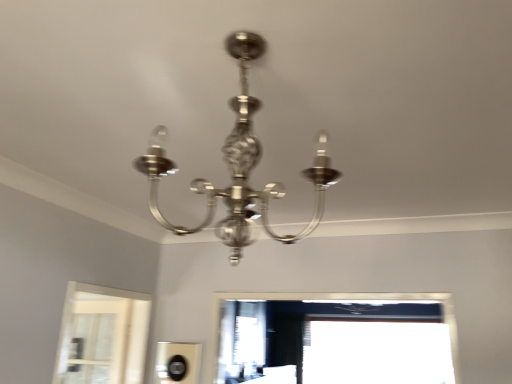
Question: Is polished silver chandelier at center facing towards transparent glass window at lower right?

Choices:
 (A) no
 (B) yes

Answer: (B)

Question: Considering the relative positions of polished silver chandelier at center and transparent glass window at lower right in the image provided, is polished silver chandelier at center to the left of transparent glass window at lower right from the viewer's perspective?

Choices:
 (A) yes
 (B) no

Answer: (A)

Question: From a real-world perspective, does polished silver chandelier at center stand above transparent glass window at lower right?

Choices:
 (A) no
 (B) yes

Answer: (B)

Question: Is the position of polished silver chandelier at center more distant than that of transparent glass window at lower right?

Choices:
 (A) no
 (B) yes

Answer: (A)

Question: Is polished silver chandelier at center shorter than transparent glass window at lower right?

Choices:
 (A) no
 (B) yes

Answer: (B)

Question: Would you say polished silver chandelier at center is a long distance from transparent glass window at lower right?

Choices:
 (A) no
 (B) yes

Answer: (B)

Question: From a real-world perspective, does transparent glass window at lower right stand above polished silver chandelier at center?

Choices:
 (A) yes
 (B) no

Answer: (B)

Question: Does transparent glass window at lower right have a lesser height compared to polished silver chandelier at center?

Choices:
 (A) no
 (B) yes

Answer: (A)

Question: Is polished silver chandelier at center inside transparent glass window at lower right?

Choices:
 (A) no
 (B) yes

Answer: (A)

Question: Is transparent glass window at lower right in contact with polished silver chandelier at center?

Choices:
 (A) no
 (B) yes

Answer: (A)

Question: Is transparent glass window at lower right wider than polished silver chandelier at center?

Choices:
 (A) no
 (B) yes

Answer: (A)

Question: Is transparent glass window at lower right taller than polished silver chandelier at center?

Choices:
 (A) yes
 (B) no

Answer: (A)

Question: Is transparent glass window at lower right spatially inside polished silver chandelier at center, or outside of it?

Choices:
 (A) outside
 (B) inside

Answer: (A)